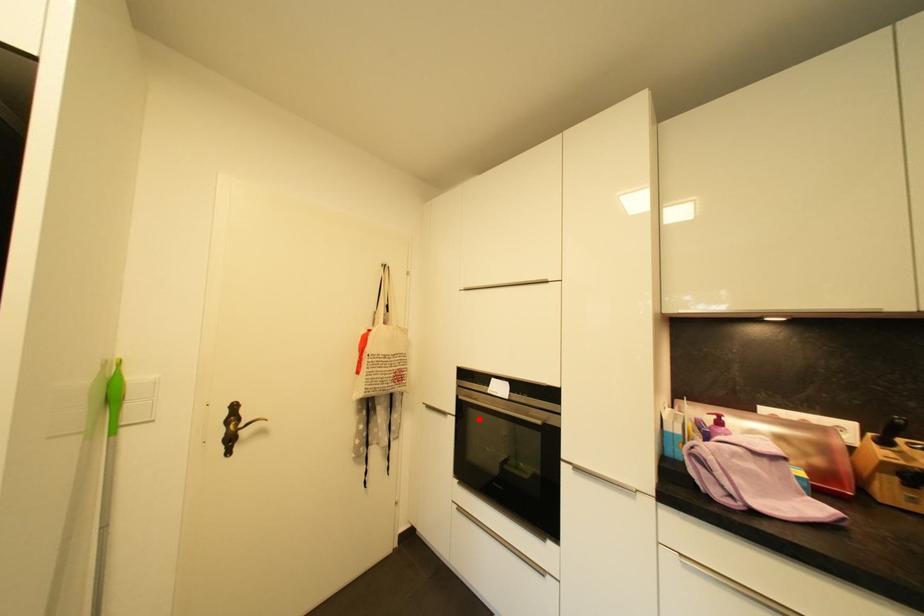
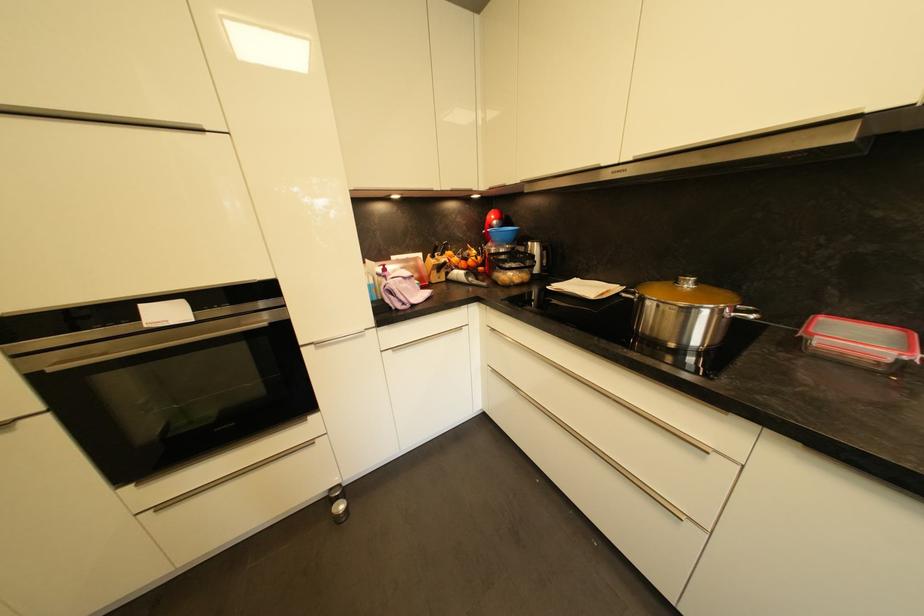
Where in the second image is the point corresponding to the highlighted location from the first image?

(124, 384)